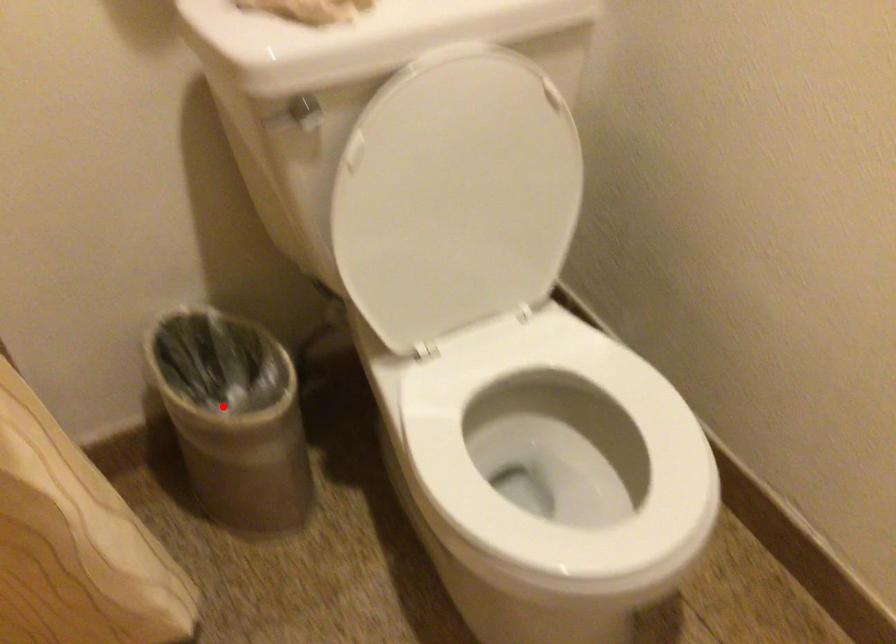
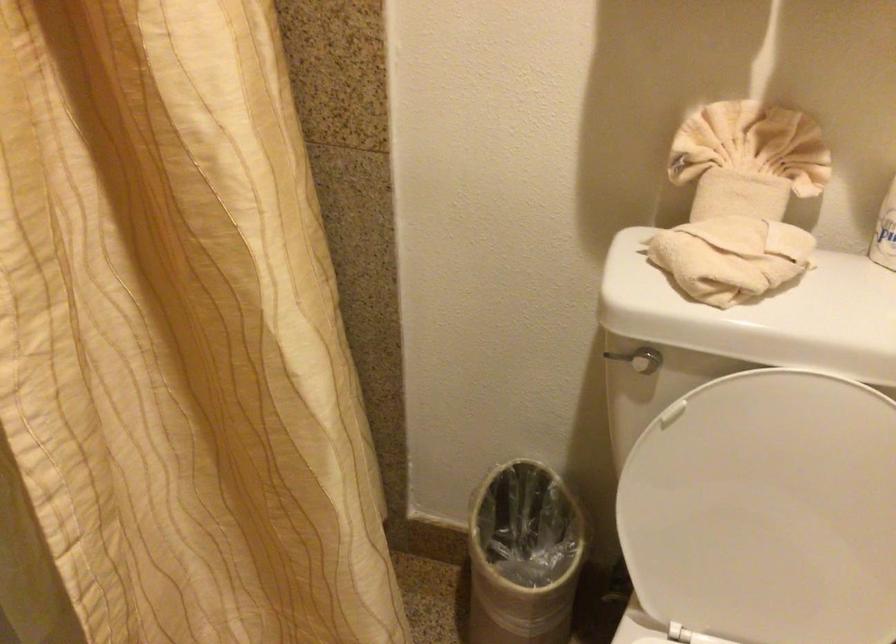
The point at the highlighted location is marked in the first image. Where is the corresponding point in the second image?

(522, 556)